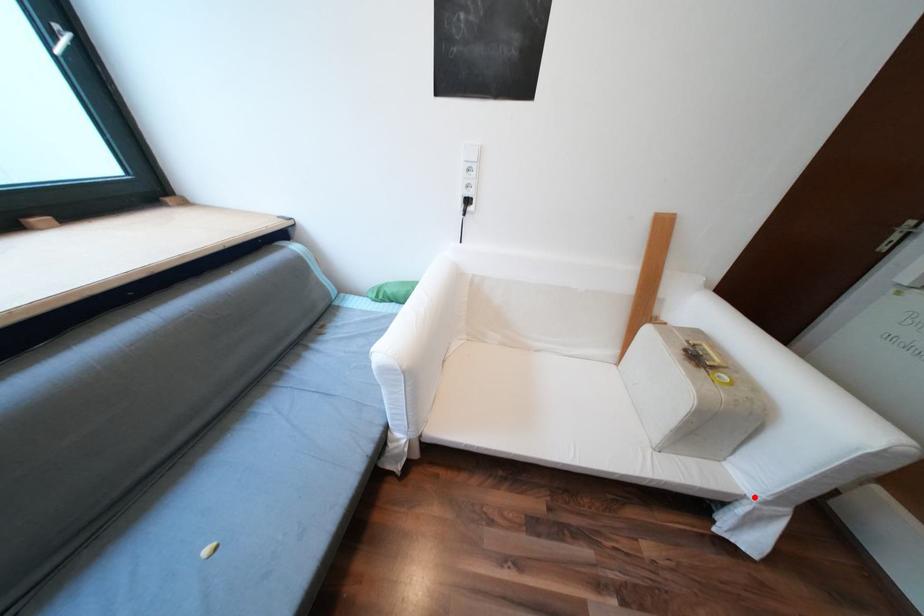
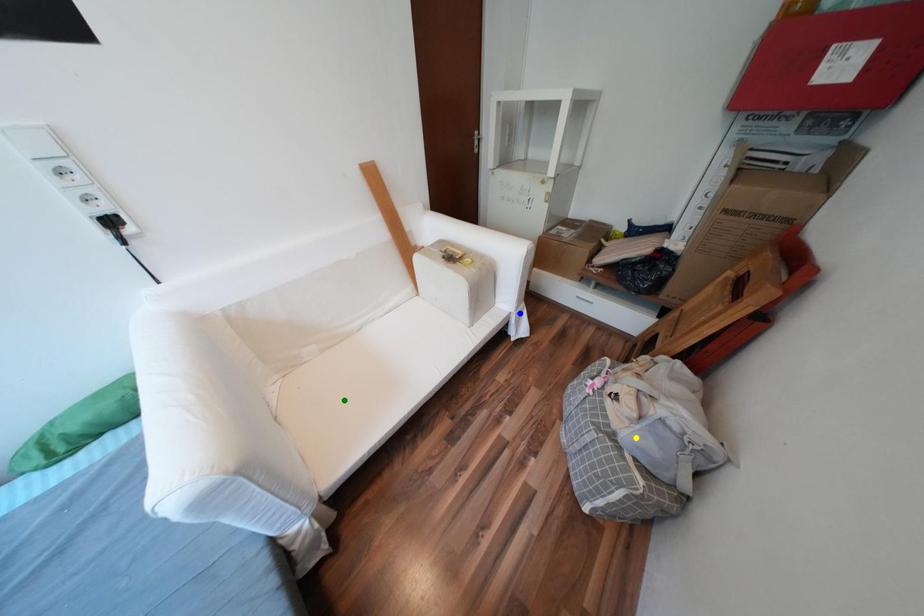
Question: I am providing you with two images of the same scene from different viewpoints. A red point is marked on the first image. You are given multiple points on the second image. Which point in image 2 represents the same 3d spot as the red point in image 1?

Choices:
 (A) green point
 (B) yellow point
 (C) blue point

Answer: (C)